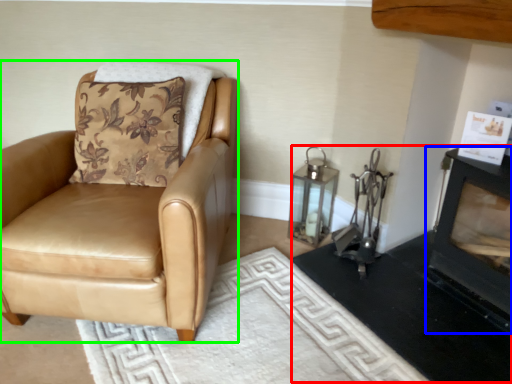
Question: Which is nearer to the fireplace (highlighted by a red box)? fireplace (highlighted by a blue box) or chair (highlighted by a green box).

Choices:
 (A) fireplace
 (B) chair

Answer: (A)